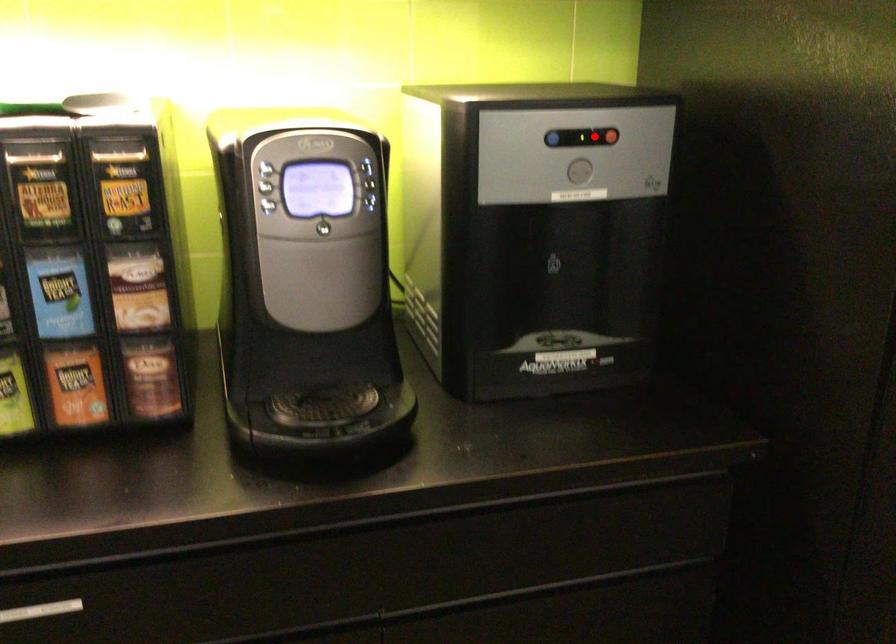
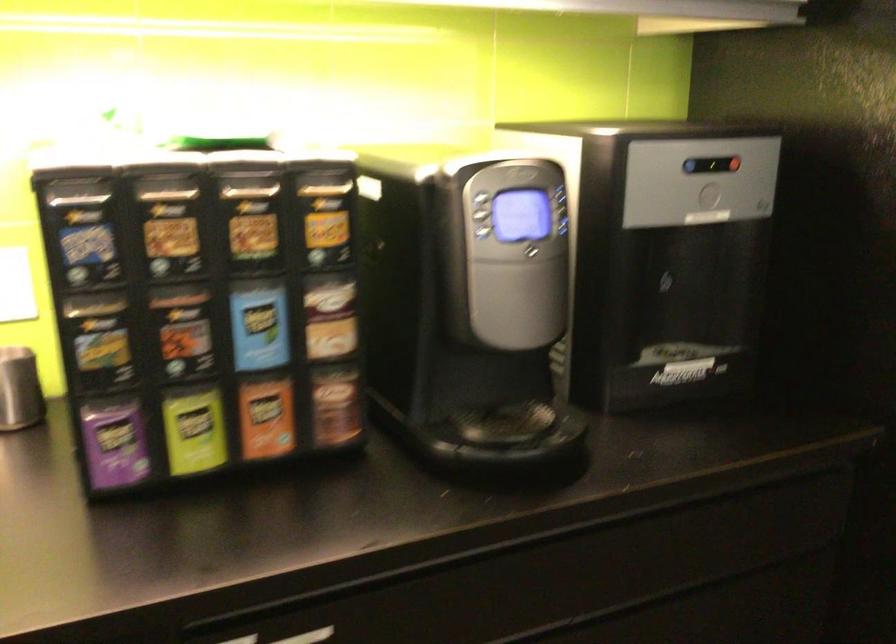
Question: I am providing you with two images of the same scene from different viewpoints. In image1, a red point is highlighted. Considering the same 3D point in image2, which of the following is correct?

Choices:
 (A) It is closer
 (B) It is farther

Answer: (B)